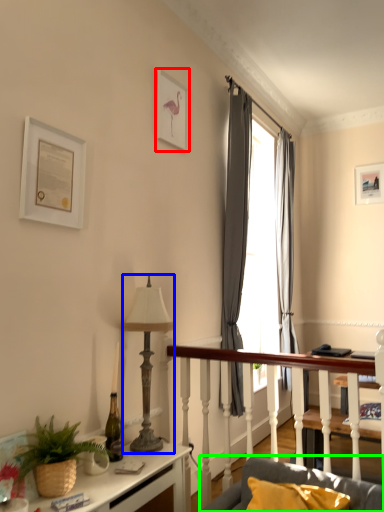
Question: Considering the real-world distances, which object is closest to picture frame (highlighted by a red box)? lamp (highlighted by a blue box) or studio couch (highlighted by a green box).

Choices:
 (A) lamp
 (B) studio couch

Answer: (A)